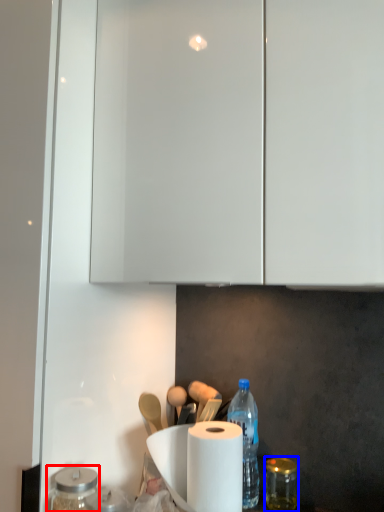
Question: Which object is further to the camera taking this photo, glass jar (highlighted by a red box) or glass jar (highlighted by a blue box)?

Choices:
 (A) glass jar
 (B) glass jar

Answer: (B)